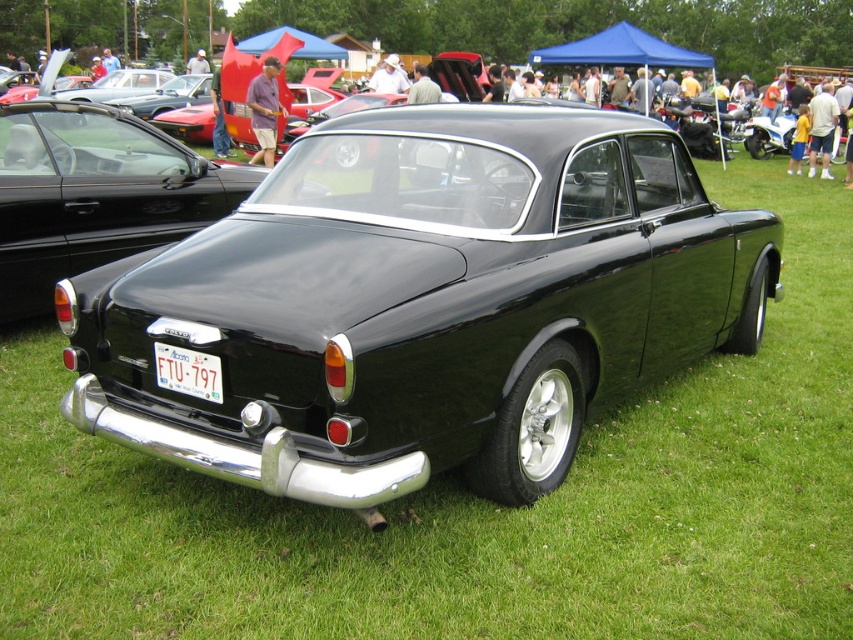
Question: Among these objects, which one is nearest to the camera?

Choices:
 (A) black glossy car at center
 (B) white plastic license plate at center

Answer: (B)

Question: Which point appears farthest from the camera in this image?

Choices:
 (A) (173, 346)
 (B) (103, 120)

Answer: (B)

Question: In this image, where is black glossy car at center located relative to white plastic license plate at center?

Choices:
 (A) below
 (B) above

Answer: (B)

Question: From the image, what is the correct spatial relationship of black glossy car at center in relation to white plastic license plate at center?

Choices:
 (A) above
 (B) below

Answer: (A)

Question: Where is black glossy car at center located in relation to white plastic license plate at center in the image?

Choices:
 (A) left
 (B) right

Answer: (A)